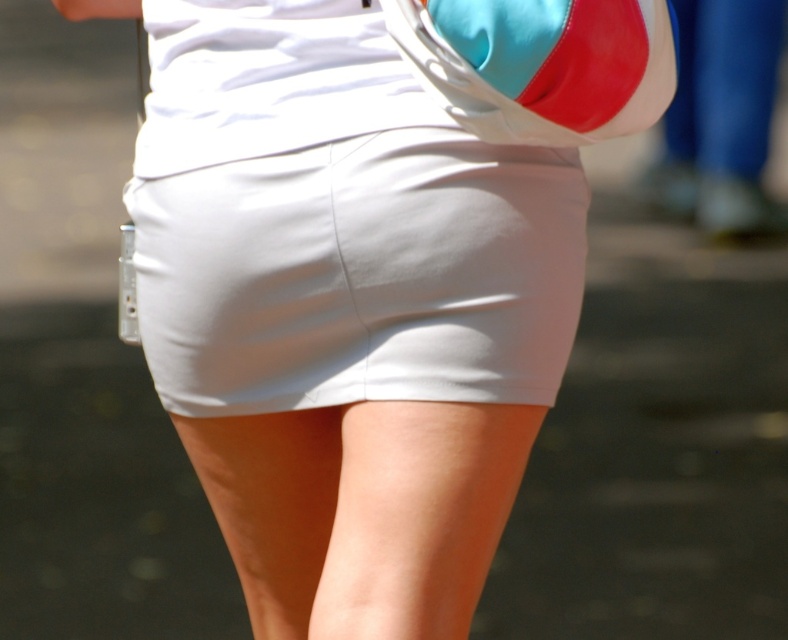
You are a photographer adjusting the focus of your camera. The subject is wearing a white smooth shorts at center. If your camera focuses on the point at coordinates 0.430, 0.459, will the shorts be in focus?

The white smooth shorts at center is located at point (361, 275), so yes, the shorts will be in focus since the camera is focused on that exact point.